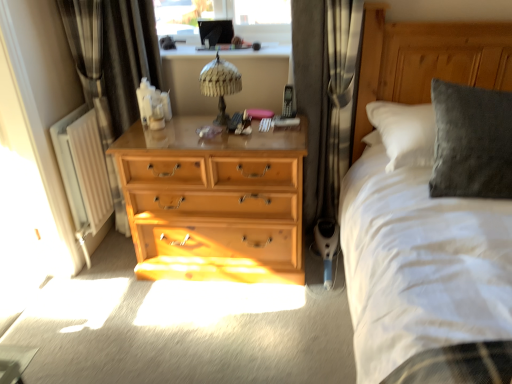
Identify the location of free space in front of light wood dresser at center. The height and width of the screenshot is (384, 512). (211, 330).